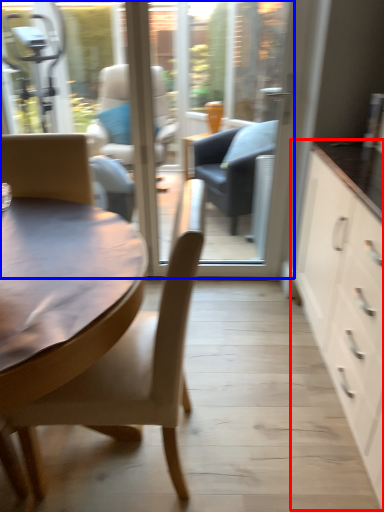
Question: Which object appears closest to the camera in this image, cabinetry (highlighted by a red box) or window screen (highlighted by a blue box)?

Choices:
 (A) cabinetry
 (B) window screen

Answer: (A)